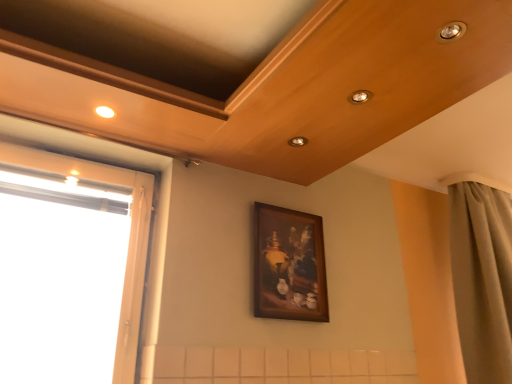
I want to click on matte beige curtain at right, so click(482, 279).

Measure the distance between point [458,247] and camera.

7.28 feet.

This screenshot has height=384, width=512. I want to click on matte beige curtain at right, so click(x=482, y=279).

From the image's perspective, between matte beige curtain at right and wooden framed painting at center, which one is located above?

Result: wooden framed painting at center, from the image's perspective.

Is matte beige curtain at right at the right side of wooden framed painting at center?

Yes, matte beige curtain at right is to the right of wooden framed painting at center.

In terms of width, does matte beige curtain at right look wider or thinner when compared to wooden framed painting at center?

Considering their sizes, matte beige curtain at right looks broader than wooden framed painting at center.

How many degrees apart are the facing directions of matte beige curtain at right and wooden framed painting at center?

There is a 1.74-degree angle between the facing directions of matte beige curtain at right and wooden framed painting at center.

Looking at this image, which is correct: transparent glass window at left is inside matte beige curtain at right, or outside of it?

transparent glass window at left lies outside matte beige curtain at right.

Is matte beige curtain at right at the back of transparent glass window at left?

No, transparent glass window at left is not facing the opposite direction of matte beige curtain at right.

From the image's perspective, is transparent glass window at left over matte beige curtain at right?

Correct, transparent glass window at left appears higher than matte beige curtain at right in the image.

From a real-world perspective, between transparent glass window at left and matte beige curtain at right, who is vertically higher?

matte beige curtain at right is physically above.

Considering the sizes of transparent glass window at left and wooden framed painting at center in the image, is transparent glass window at left bigger or smaller than wooden framed painting at center?

Clearly, transparent glass window at left is larger in size than wooden framed painting at center.

Does point (53, 160) lie behind point (280, 225)?

That is False.

Is transparent glass window at left in front of wooden framed painting at center?

Yes, transparent glass window at left is closer to the viewer.

From the image's perspective, between transparent glass window at left and wooden framed painting at center, who is located below?

wooden framed painting at center appears lower in the image.

Is wooden framed painting at center beside transparent glass window at left?

No, wooden framed painting at center is not next to transparent glass window at left.

Is transparent glass window at left at the back of wooden framed painting at center?

No, transparent glass window at left is not at the back of wooden framed painting at center.

In the image, is wooden framed painting at center positioned in front of or behind transparent glass window at left?

wooden framed painting at center is positioned farther from the viewer than transparent glass window at left.

Is wooden framed painting at center looking in the opposite direction of matte beige curtain at right?

No.

From the image's perspective, which is below, wooden framed painting at center or matte beige curtain at right?

matte beige curtain at right.

Looking at this image, does wooden framed painting at center have a lesser width compared to matte beige curtain at right?

Correct, the width of wooden framed painting at center is less than that of matte beige curtain at right.

Based on the photo, is matte beige curtain at right taller or shorter than transparent glass window at left?

Clearly, matte beige curtain at right is taller compared to transparent glass window at left.

Are matte beige curtain at right and transparent glass window at left located far from each other?

Yes, matte beige curtain at right and transparent glass window at left are quite far apart.

Consider the image. Is matte beige curtain at right spatially inside transparent glass window at left, or outside of it?

matte beige curtain at right is outside transparent glass window at left.

Which point is more distant from viewer, (490, 352) or (9, 163)?

The point (490, 352) is farther from the camera.

The height and width of the screenshot is (384, 512). What are the coordinates of `picture frame in front of the matte beige curtain at right` in the screenshot? It's located at (289, 265).

Find the location of a particular element. This screenshot has height=384, width=512. curtain below the transparent glass window at left (from the image's perspective) is located at coordinates (482, 279).

Considering their positions, is transparent glass window at left positioned closer to matte beige curtain at right than wooden framed painting at center?

The object closer to matte beige curtain at right is wooden framed painting at center.

Based on their spatial positions, is matte beige curtain at right or wooden framed painting at center closer to transparent glass window at left?

Among the two, wooden framed painting at center is located nearer to transparent glass window at left.

Which object lies nearer to the anchor point matte beige curtain at right, wooden framed painting at center or transparent glass window at left?

Based on the image, wooden framed painting at center appears to be nearer to matte beige curtain at right.

Looking at the image, which one is located further to wooden framed painting at center, matte beige curtain at right or transparent glass window at left?

Among the two, matte beige curtain at right is located further to wooden framed painting at center.

Based on their spatial positions, is transparent glass window at left or matte beige curtain at right further from wooden framed painting at center?

matte beige curtain at right.

Which object lies nearer to the anchor point transparent glass window at left, wooden framed painting at center or matte beige curtain at right?

Based on the image, wooden framed painting at center appears to be nearer to transparent glass window at left.

This screenshot has height=384, width=512. In order to click on picture frame between transparent glass window at left and matte beige curtain at right in this screenshot , I will do point(289,265).